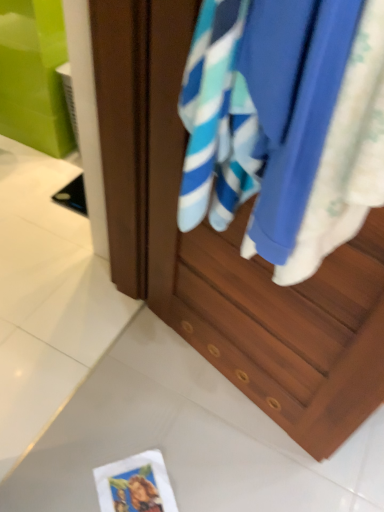
Locate an element on the screen. blank space to the left of wooden cabinet at center is located at coordinates (144, 386).